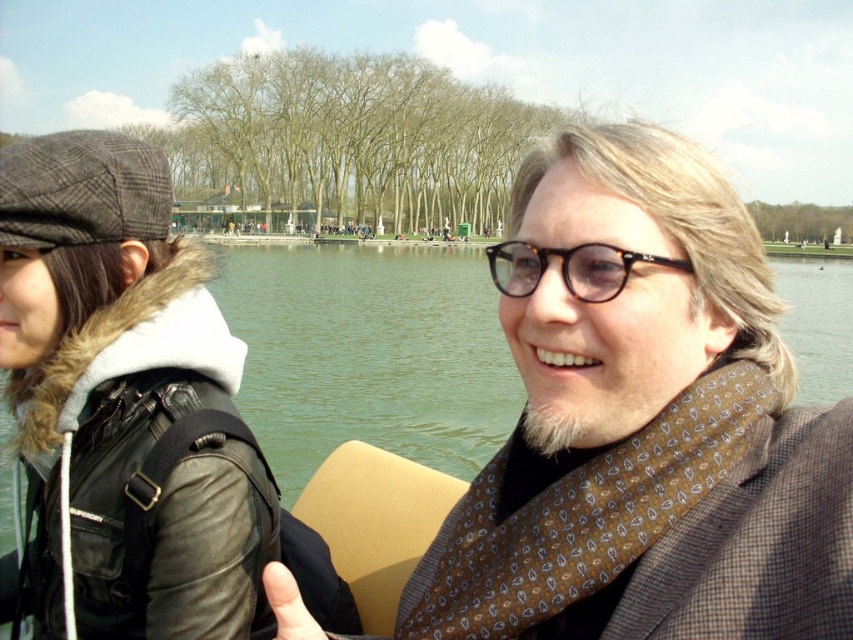
Who is more forward, (39,140) or (517,292)?

Point (517,292) is more forward.

Is leather jacket at left closer to camera compared to tortoiseshell frame glasses at center?

No, leather jacket at left is behind tortoiseshell frame glasses at center.

This screenshot has width=853, height=640. I want to click on leather jacket at left, so click(125, 401).

Find the location of a particular element. The image size is (853, 640). leather jacket at left is located at coordinates (125, 401).

The image size is (853, 640). Describe the element at coordinates (646, 429) in the screenshot. I see `matte black jacket at left` at that location.

Which is above, matte black jacket at left or leather jacket at left?

matte black jacket at left is higher up.

Is point (552, 589) positioned in front of point (180, 547)?

Yes, it is.

What are the coordinates of `matte black jacket at left` in the screenshot? It's located at 646,429.

Which is more to the right, leather jacket at left or green water at center?

From the viewer's perspective, green water at center appears more on the right side.

Is the position of leather jacket at left more distant than that of green water at center?

Yes, it is behind green water at center.

This screenshot has height=640, width=853. Describe the element at coordinates (125, 401) in the screenshot. I see `leather jacket at left` at that location.

The width and height of the screenshot is (853, 640). Identify the location of leather jacket at left. (125, 401).